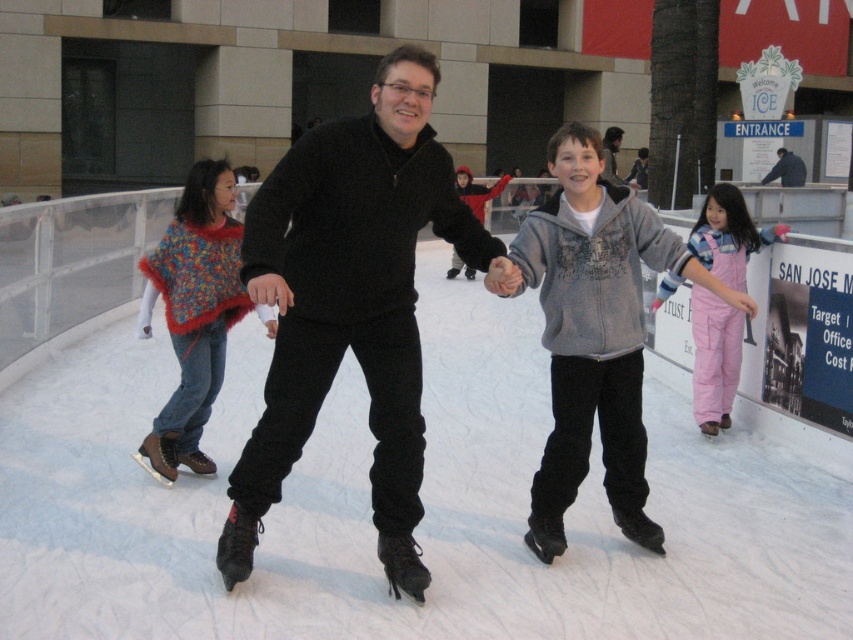
Is knitted multicolored shawl at left closer to the viewer compared to pink cotton overalls at lower right?

Yes, it is in front of pink cotton overalls at lower right.

Does knitted multicolored shawl at left have a lesser width compared to pink cotton overalls at lower right?

No.

Identify the location of knitted multicolored shawl at left. This screenshot has height=640, width=853. (195, 312).

Is point (316, 390) positioned in front of point (706, 330)?

That is True.

Does black matte sweater at center have a lesser height compared to pink cotton overalls at lower right?

No.

Locate an element on the screen. The height and width of the screenshot is (640, 853). black matte sweater at center is located at coordinates (350, 301).

Where is `black matte sweater at center`? This screenshot has width=853, height=640. black matte sweater at center is located at coordinates point(350,301).

Does black matte sweater at center have a lesser width compared to gray fleece jacket at center?

Yes.

Locate an element on the screen. The height and width of the screenshot is (640, 853). black matte sweater at center is located at coordinates (350, 301).